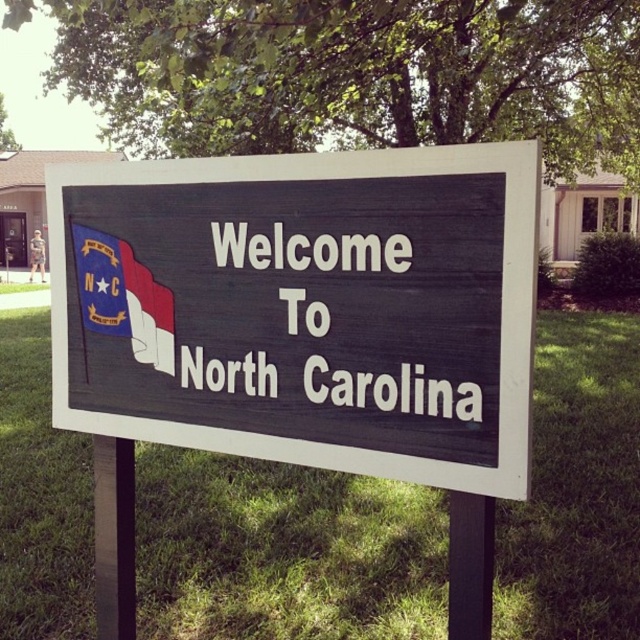
You are standing at the point marked by the coordinates point (284, 552) in the image. What is the color of the surface you are currently standing on?

The point (284, 552) corresponds to green grass at center, so the surface you are standing on is green.

You are a photographer standing in front of the sign and want to capture both the green grass at center and the matte red flag at upper left in your shot. Which object will appear closer to the camera in the photo?

The green grass at center will appear closer to the camera because it is further to the viewer than the matte red flag at upper left.